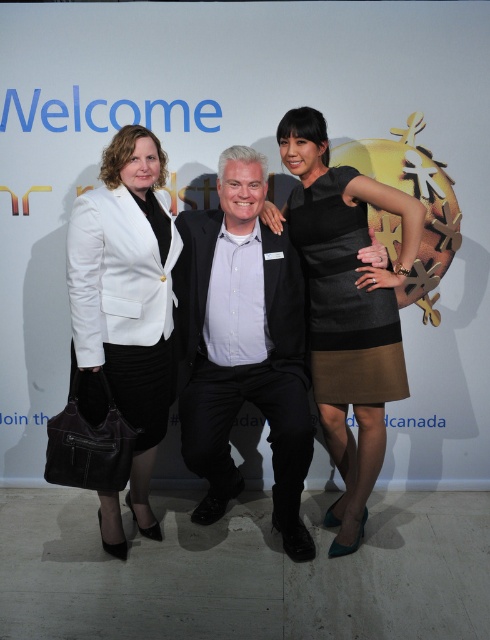
Does black satin dress at center have a greater width compared to matte black blazer at left?

Indeed, black satin dress at center has a greater width compared to matte black blazer at left.

Between black satin dress at center and matte black blazer at left, which one is positioned higher?

black satin dress at center

This screenshot has height=640, width=490. What are the coordinates of `black satin dress at center` in the screenshot? It's located at (345, 307).

Is black cotton suit at center positioned before matte black blazer at left?

No.

Between point (222, 332) and point (155, 241), which one is positioned in front?

Point (155, 241) is in front.

Identify the location of black cotton suit at center. (242, 346).

Consider the image. Is black cotton suit at center shorter than black satin dress at center?

Yes.

Is black cotton suit at center wider than black satin dress at center?

No, black cotton suit at center is not wider than black satin dress at center.

Who is more forward, (292, 394) or (283, 134)?

Point (292, 394) is more forward.

Locate an element on the screen. black cotton suit at center is located at coordinates (242, 346).